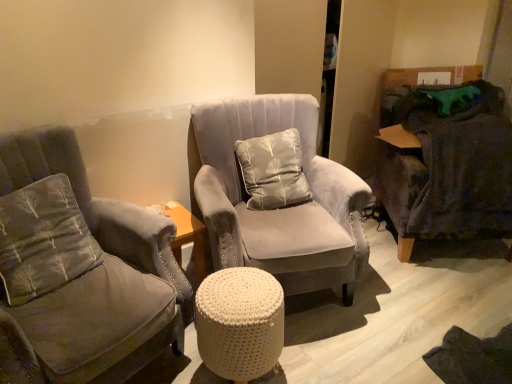
Question: Can you see dark gray fabric swivel chair at right touching velvet gray armchair at left, arranged as the 2th chair when viewed from the right?

Choices:
 (A) yes
 (B) no

Answer: (B)

Question: Does dark gray fabric swivel chair at right turn towards velvet gray armchair at left, which is the 1th chair in left-to-right order?

Choices:
 (A) yes
 (B) no

Answer: (B)

Question: From a real-world perspective, is dark gray fabric swivel chair at right under velvet gray armchair at left, arranged as the 2th chair when viewed from the right?

Choices:
 (A) no
 (B) yes

Answer: (B)

Question: Is dark gray fabric swivel chair at right facing away from velvet gray armchair at left, arranged as the 2th chair when viewed from the right?

Choices:
 (A) no
 (B) yes

Answer: (A)

Question: Can you confirm if dark gray fabric swivel chair at right is smaller than velvet gray armchair at left, which is the 1th chair in left-to-right order?

Choices:
 (A) no
 (B) yes

Answer: (B)

Question: Considering the relative positions of white knitted pouf at center and gray fabric pillow at left, which is the 2th pillow in right-to-left order, in the image provided, is white knitted pouf at center to the left or to the right of gray fabric pillow at left, which is the 2th pillow in right-to-left order,?

Choices:
 (A) right
 (B) left

Answer: (A)

Question: From the image's perspective, is white knitted pouf at center located above or below gray fabric pillow at left, the first pillow viewed from the left?

Choices:
 (A) below
 (B) above

Answer: (A)

Question: Is white knitted pouf at center situated inside gray fabric pillow at left, placed as the 2th pillow when sorted from back to front, or outside?

Choices:
 (A) outside
 (B) inside

Answer: (A)

Question: Considering the positions of point (214, 350) and point (32, 213), is point (214, 350) closer or farther from the camera than point (32, 213)?

Choices:
 (A) closer
 (B) farther

Answer: (A)

Question: Based on their positions, is gray fabric pillow at left, placed as the 2th pillow when sorted from back to front, located to the left or right of suede gray chair at center, the second chair when ordered from left to right?

Choices:
 (A) right
 (B) left

Answer: (B)

Question: Is point click(x=33, y=273) positioned closer to the camera than point click(x=355, y=273)?

Choices:
 (A) farther
 (B) closer

Answer: (B)

Question: From a real-world perspective, relative to suede gray chair at center, the first chair in the right-to-left sequence, is gray fabric pillow at left, placed as the 2th pillow when sorted from back to front, vertically above or below?

Choices:
 (A) above
 (B) below

Answer: (A)

Question: In the image, is gray fabric pillow at left, the first pillow viewed from the left, positioned in front of or behind suede gray chair at center, the first chair in the right-to-left sequence?

Choices:
 (A) front
 (B) behind

Answer: (A)

Question: In terms of width, does dark gray fabric swivel chair at right look wider or thinner when compared to light gray fabric pillow at center, which is the first pillow from back to front?

Choices:
 (A) wide
 (B) thin

Answer: (A)

Question: Would you say dark gray fabric swivel chair at right is to the left or to the right of light gray fabric pillow at center, which is the first pillow from back to front, in the picture?

Choices:
 (A) left
 (B) right

Answer: (B)